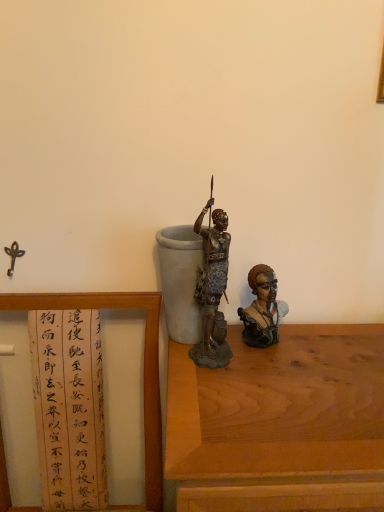
This screenshot has height=512, width=384. Find the location of `free space in front of bronze statue at center, the second person when ordered from right to left`. free space in front of bronze statue at center, the second person when ordered from right to left is located at coordinates (236, 404).